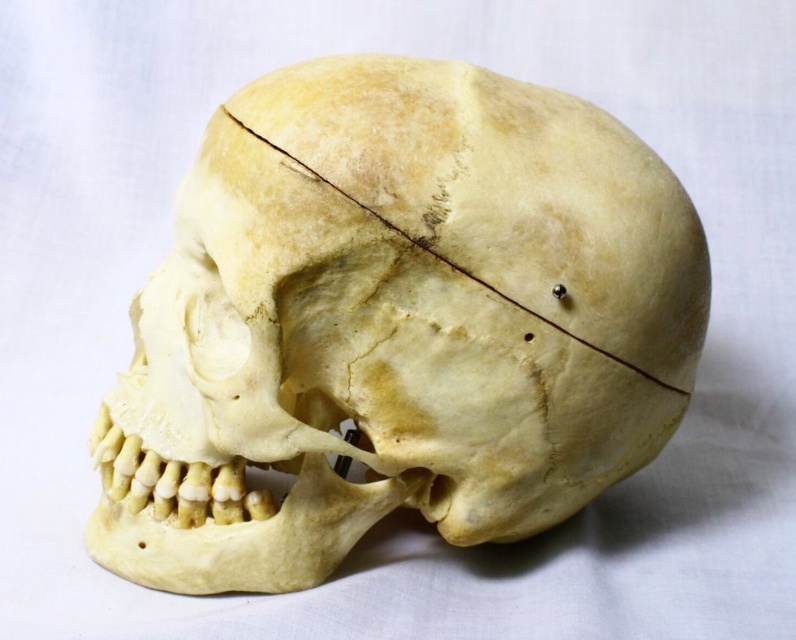
Is point (322, 300) behind point (408, 240)?

Yes, it is.

The width and height of the screenshot is (796, 640). Describe the element at coordinates (395, 323) in the screenshot. I see `yellowish bone skull at center` at that location.

In order to click on yellowish bone skull at center in this screenshot , I will do `click(395, 323)`.